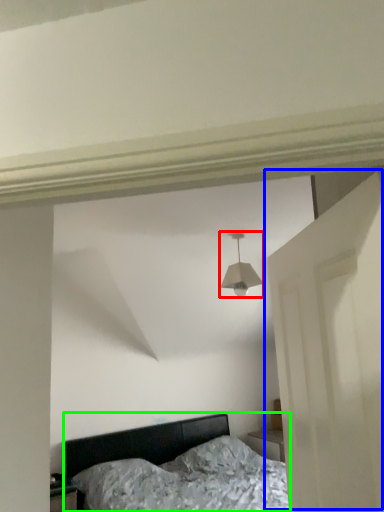
Question: Based on their relative distances, which object is farther from lamp (highlighted by a red box)? Choose from door (highlighted by a blue box) and bed (highlighted by a green box).

Choices:
 (A) door
 (B) bed

Answer: (B)